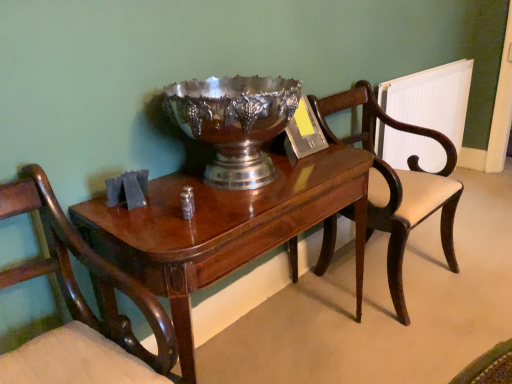
What do you see at coordinates (87, 267) in the screenshot? The height and width of the screenshot is (384, 512). I see `mahogany wood chair at left, which is the 2th chair from right to left` at bounding box center [87, 267].

Image resolution: width=512 pixels, height=384 pixels. Describe the element at coordinates (397, 185) in the screenshot. I see `mahogany wood chair at right, which is the 1th chair in right-to-left order` at that location.

The image size is (512, 384). Find the location of `mahogany wood chair at left, which is the 1th chair in left-to-right order`. mahogany wood chair at left, which is the 1th chair in left-to-right order is located at coordinates (87, 267).

Is point (170, 91) closer or farther from the camera than point (140, 350)?

Clearly, point (170, 91) is more distant from the camera than point (140, 350).

In terms of height, does shiny silver bowl at center look taller or shorter compared to mahogany wood chair at left, which is the 2th chair from right to left?

shiny silver bowl at center is shorter than mahogany wood chair at left, which is the 2th chair from right to left.

In the scene shown: Could you tell me if shiny silver bowl at center is facing mahogany wood chair at left, positioned as the 1th chair in front-to-back order?

No, shiny silver bowl at center does not turn towards mahogany wood chair at left, positioned as the 1th chair in front-to-back order.

Looking at this image, from the image's perspective, does shiny silver bowl at center appear lower than mahogany wood chair at left, which is the 2th chair from right to left?

No.

Would you say shiny silver bowl at center is part of mahogany wood table at center's contents?

No, shiny silver bowl at center is not surrounded by mahogany wood table at center.

How different are the orientations of mahogany wood table at center and shiny silver bowl at center in degrees?

0.000285 degrees.

Is point (325, 216) closer to camera compared to point (271, 176)?

That is False.

Is mahogany wood table at center taller than shiny silver bowl at center?

Yes, mahogany wood table at center is taller than shiny silver bowl at center.

Looking at this image, from the image's perspective, is mahogany wood table at center on mahogany wood chair at left, which is the 2th chair from right to left?

Yes, from the image's perspective, mahogany wood table at center is on top of mahogany wood chair at left, which is the 2th chair from right to left.

Would you say mahogany wood table at center is inside or outside mahogany wood chair at left, which is the 1th chair in left-to-right order?

mahogany wood table at center cannot be found inside mahogany wood chair at left, which is the 1th chair in left-to-right order.

Which object is positioned more to the left, mahogany wood table at center or mahogany wood chair at left, positioned as the 1th chair in front-to-back order?

mahogany wood chair at left, positioned as the 1th chair in front-to-back order, is more to the left.

Considering the sizes of mahogany wood table at center and mahogany wood chair at left, which is the 1th chair in left-to-right order, in the image, is mahogany wood table at center taller or shorter than mahogany wood chair at left, which is the 1th chair in left-to-right order,?

Clearly, mahogany wood table at center is shorter compared to mahogany wood chair at left, which is the 1th chair in left-to-right order.

Where is `chair that is the 1st object located below the shiny silver bowl at center (from the image's perspective)`? This screenshot has width=512, height=384. chair that is the 1st object located below the shiny silver bowl at center (from the image's perspective) is located at coordinates (397, 185).

Would you say shiny silver bowl at center is a long distance from mahogany wood chair at right, marked as the 2th chair in a front-to-back arrangement?

No, shiny silver bowl at center is not far from mahogany wood chair at right, marked as the 2th chair in a front-to-back arrangement.

How many degrees apart are the facing directions of shiny silver bowl at center and mahogany wood chair at right, marked as the 2th chair in a front-to-back arrangement?

They differ by 0.000208 degrees in their facing directions.

Which object is positioned more to the left, shiny silver bowl at center or mahogany wood chair at right, the 1th chair from the back?

From the viewer's perspective, shiny silver bowl at center appears more on the left side.

Is the depth of mahogany wood chair at left, positioned as the 1th chair in front-to-back order, less than that of white plastic radiator at right?

Yes, mahogany wood chair at left, positioned as the 1th chair in front-to-back order, is in front of white plastic radiator at right.

How different are the orientations of mahogany wood chair at left, which is the 1th chair in left-to-right order, and white plastic radiator at right in degrees?

1.53 degrees.

Which is more distant, (x=69, y=230) or (x=463, y=90)?

The point (x=463, y=90) is behind.

Considering the relative positions of mahogany wood chair at left, which is the 2th chair from right to left, and white plastic radiator at right in the image provided, is mahogany wood chair at left, which is the 2th chair from right to left, to the right of white plastic radiator at right from the viewer's perspective?

No, mahogany wood chair at left, which is the 2th chair from right to left, is not to the right of white plastic radiator at right.

Which is behind, point (232, 89) or point (331, 147)?

The point (331, 147) is farther from the camera.

Based on the photo, are shiny silver bowl at center and mahogany wood table at center making contact?

No.

Considering their positions, is shiny silver bowl at center located in front of or behind mahogany wood table at center?

shiny silver bowl at center is positioned farther from the viewer than mahogany wood table at center.

The height and width of the screenshot is (384, 512). Identify the location of chair behind the mahogany wood table at center. (397, 185).

Are mahogany wood chair at right, the 1th chair from the back, and mahogany wood table at center far apart?

Actually, mahogany wood chair at right, the 1th chair from the back, and mahogany wood table at center are a little close together.

From a real-world perspective, is mahogany wood chair at right, which is the 1th chair in right-to-left order, under mahogany wood table at center?

Incorrect, from a real-world perspective, mahogany wood chair at right, which is the 1th chair in right-to-left order, is higher than mahogany wood table at center.

Is mahogany wood chair at right, the 1th chair from the back, not inside mahogany wood table at center?

mahogany wood chair at right, the 1th chair from the back, lies outside mahogany wood table at center's area.

The height and width of the screenshot is (384, 512). In order to click on bowl that appears above the mahogany wood chair at left, the 2th chair positioned from the back (from a real-world perspective) in this screenshot , I will do `click(234, 123)`.

The image size is (512, 384). Identify the location of table below the shiny silver bowl at center (from a real-world perspective). (224, 229).

When comparing their distances from white plastic radiator at right, does mahogany wood chair at left, positioned as the 1th chair in front-to-back order, or shiny silver bowl at center seem further?

mahogany wood chair at left, positioned as the 1th chair in front-to-back order, is further to white plastic radiator at right.

From the image, which object appears to be farther from mahogany wood table at center, mahogany wood chair at left, which is the 1th chair in left-to-right order, or mahogany wood chair at right, arranged as the second chair when viewed from the left?

Based on the image, mahogany wood chair at right, arranged as the second chair when viewed from the left, appears to be further to mahogany wood table at center.

Based on their spatial positions, is mahogany wood chair at left, which is the 1th chair in left-to-right order, or mahogany wood chair at right, arranged as the second chair when viewed from the left, further from white plastic radiator at right?

mahogany wood chair at left, which is the 1th chair in left-to-right order, is further to white plastic radiator at right.

Based on their spatial positions, is white plastic radiator at right or mahogany wood chair at left, positioned as the 1th chair in front-to-back order, further from shiny silver bowl at center?

white plastic radiator at right is positioned further to the anchor shiny silver bowl at center.

Looking at the image, which one is located closer to shiny silver bowl at center, mahogany wood chair at left, the 2th chair positioned from the back, or white plastic radiator at right?

mahogany wood chair at left, the 2th chair positioned from the back, lies closer to shiny silver bowl at center than the other object.

Based on their spatial positions, is shiny silver bowl at center or mahogany wood chair at right, which is the 1th chair in right-to-left order, closer to mahogany wood chair at left, which is the 2th chair from right to left?

shiny silver bowl at center is closer to mahogany wood chair at left, which is the 2th chair from right to left.

From the image, which object appears to be nearer to shiny silver bowl at center, white plastic radiator at right or mahogany wood chair at right, which is the 1th chair in right-to-left order?

mahogany wood chair at right, which is the 1th chair in right-to-left order.

Consider the image. Based on their spatial positions, is mahogany wood table at center or mahogany wood chair at right, the 1th chair from the back, further from mahogany wood chair at left, which is the 1th chair in left-to-right order?

Based on the image, mahogany wood chair at right, the 1th chair from the back, appears to be further to mahogany wood chair at left, which is the 1th chair in left-to-right order.

Image resolution: width=512 pixels, height=384 pixels. I want to click on chair between mahogany wood chair at left, which is the 1th chair in left-to-right order, and white plastic radiator at right from front to back, so tap(397, 185).

At what (x,y) coordinates should I click in order to perform the action: click on chair between shiny silver bowl at center and white plastic radiator at right from left to right. Please return your answer as a coordinate pair (x, y). The height and width of the screenshot is (384, 512). Looking at the image, I should click on (397, 185).

The width and height of the screenshot is (512, 384). What are the coordinates of `bowl between mahogany wood chair at left, which is the 2th chair from right to left, and mahogany wood chair at right, the 1th chair from the back, in the horizontal direction` in the screenshot? It's located at (234, 123).

Find the location of `chair between mahogany wood table at center and white plastic radiator at right in the front-back direction`. chair between mahogany wood table at center and white plastic radiator at right in the front-back direction is located at coordinates (397, 185).